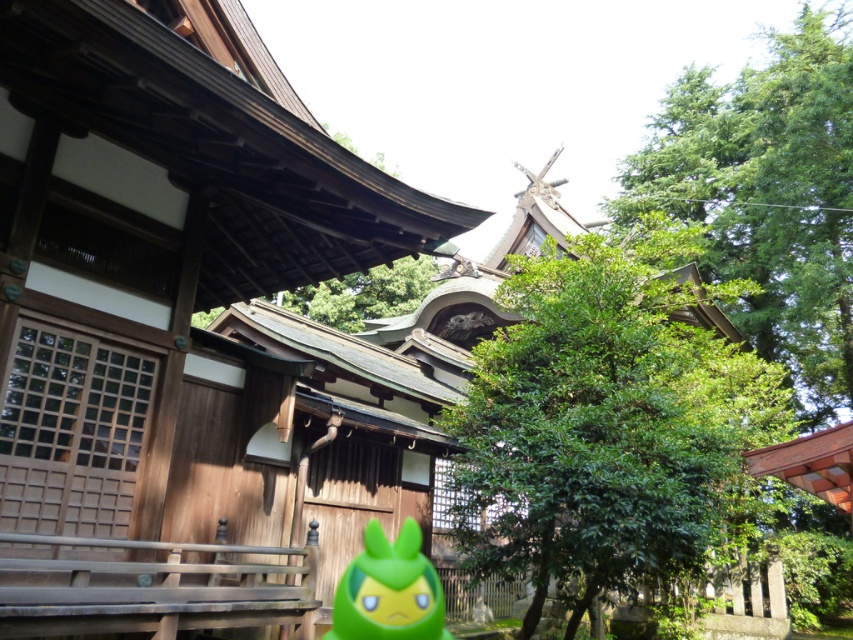
Which of these two, green leafy tree at center or green leafy tree at upper right, stands shorter?

green leafy tree at center

Does point (604, 376) lie in front of point (770, 49)?

That is True.

Which is behind, point (523, 536) or point (749, 163)?

The point (749, 163) is behind.

Find the location of a particular element. Image resolution: width=853 pixels, height=640 pixels. green leafy tree at center is located at coordinates (605, 422).

Measure the distance between point (825,188) and camera.

Point (825,188) is 16.24 meters away from camera.

Between point (724, 128) and point (350, 612), which one is positioned behind?

The point (724, 128) is behind.

Where is `green leafy tree at upper right`? green leafy tree at upper right is located at coordinates [x=769, y=196].

Is green leafy tree at center taller than green rubber toy at center?

No, green leafy tree at center is not taller than green rubber toy at center.

What do you see at coordinates (605, 422) in the screenshot? I see `green leafy tree at center` at bounding box center [605, 422].

Where is `green leafy tree at center`? The height and width of the screenshot is (640, 853). green leafy tree at center is located at coordinates (605, 422).